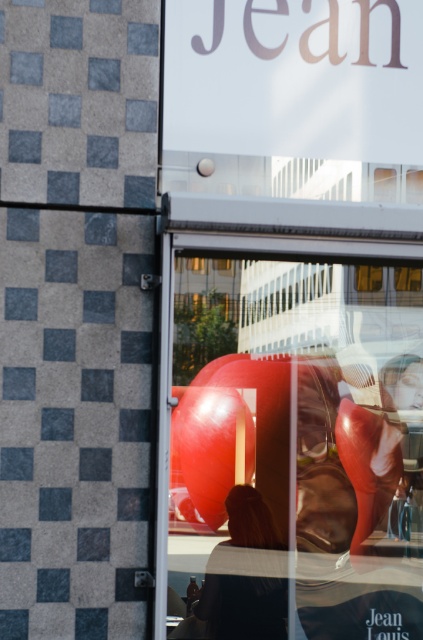
Question: Among these objects, which one is nearest to the camera?

Choices:
 (A) glossy red sculpture at center
 (B) blonde hair at center

Answer: (A)

Question: Is glossy red sculpture at center behind blonde hair at center?

Choices:
 (A) no
 (B) yes

Answer: (A)

Question: Does glossy red sculpture at center have a larger size compared to blonde hair at center?

Choices:
 (A) yes
 (B) no

Answer: (A)

Question: Which of the following is the farthest from the observer?

Choices:
 (A) blonde hair at center
 (B) glossy red sculpture at center

Answer: (A)

Question: Among these objects, which one is nearest to the camera?

Choices:
 (A) glossy red sculpture at center
 (B) blonde hair at center

Answer: (A)

Question: Is glossy red sculpture at center further to the viewer compared to blonde hair at center?

Choices:
 (A) yes
 (B) no

Answer: (B)